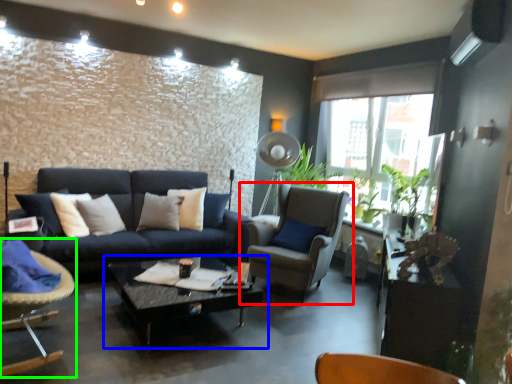
Question: Which is nearer to the chair (highlighted by a red box)? coffee table (highlighted by a blue box) or chair (highlighted by a green box).

Choices:
 (A) coffee table
 (B) chair

Answer: (A)